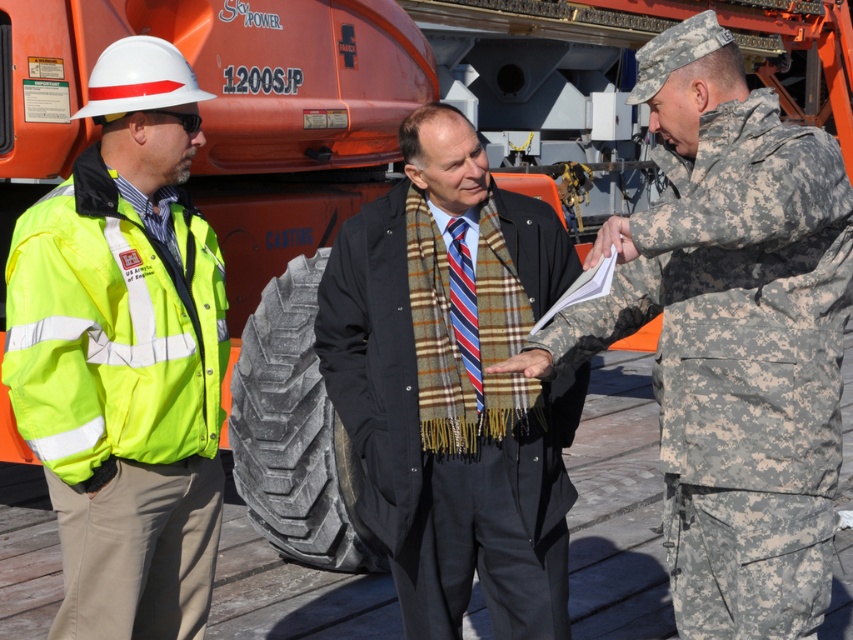
Between plaid scarf at center and high-visibility fabric jacket at left, which one has more height?

With more height is plaid scarf at center.

Is point (392, 211) positioned before point (24, 420)?

That is False.

Does point (427, 609) come closer to viewer compared to point (105, 240)?

No, (427, 609) is behind (105, 240).

Identify the location of plaid scarf at center. Image resolution: width=853 pixels, height=640 pixels. (453, 385).

Does high-visibility fabric jacket at left have a greater height compared to neon yellow reflective safety vest at center?

Indeed, high-visibility fabric jacket at left has a greater height compared to neon yellow reflective safety vest at center.

Can you confirm if high-visibility fabric jacket at left is shorter than neon yellow reflective safety vest at center?

No.

The width and height of the screenshot is (853, 640). What do you see at coordinates (120, 400) in the screenshot? I see `high-visibility fabric jacket at left` at bounding box center [120, 400].

This screenshot has width=853, height=640. I want to click on high-visibility fabric jacket at left, so click(120, 400).

Does plaid scarf at center have a greater height compared to striped fabric tie at center?

Yes.

Which is behind, point (354, 228) or point (479, 413)?

The point (354, 228) is behind.

The height and width of the screenshot is (640, 853). In order to click on plaid scarf at center in this screenshot , I will do `click(453, 385)`.